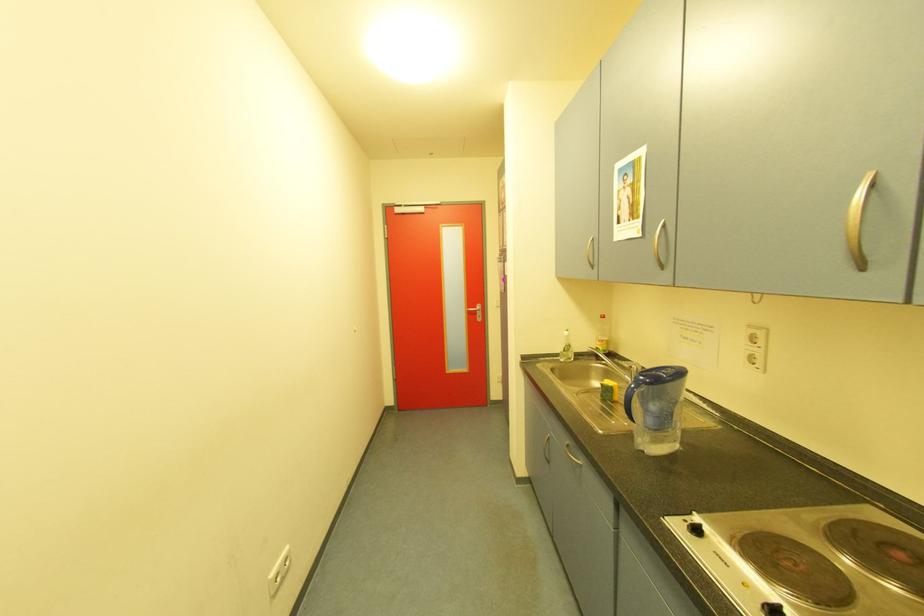
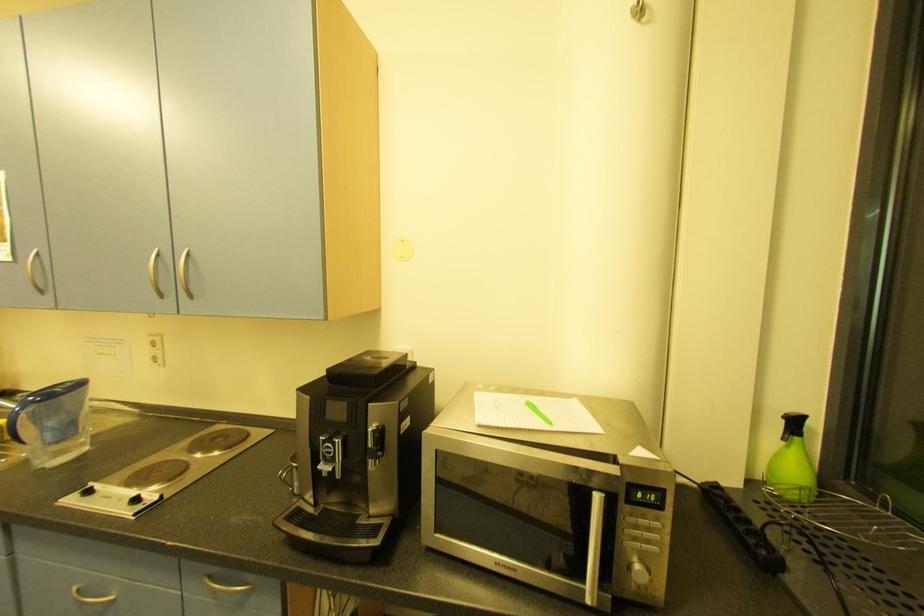
Question: The camera is either moving clockwise (left) or counter-clockwise (right) around the object. The first image is from the beginning of the video and the second image is from the end. Is the camera moving left or right when shooting the video?

Choices:
 (A) Left
 (B) Right

Answer: (A)